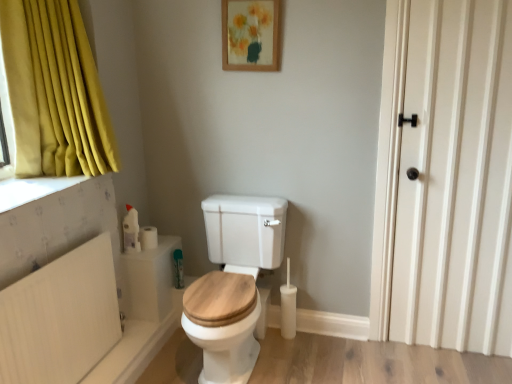
Question: In terms of width, does wooden toilet seat at center look wider or thinner when compared to white plastic radiator at lower left?

Choices:
 (A) thin
 (B) wide

Answer: (B)

Question: Is point (223, 311) positioned closer to the camera than point (92, 249)?

Choices:
 (A) closer
 (B) farther

Answer: (A)

Question: Which is nearer to the green plastic toothbrush at lower center?

Choices:
 (A) wooden toilet seat at center
 (B) wooden picture frame at upper center
 (C) white matte toilet paper at lower left, marked as the 2th toilet paper in a back-to-front arrangement
 (D) white plastic radiator at lower left
 (E) white matte toilet paper at lower left, the first toilet paper viewed from the back

Answer: (E)

Question: Which object is positioned closest to the white matte door at right?

Choices:
 (A) wooden toilet seat at center
 (B) wooden picture frame at upper center
 (C) white matte toilet paper at lower left, positioned as the first toilet paper in front-to-back order
 (D) white plastic radiator at lower left
 (E) white matte toilet paper at lower left, the first toilet paper viewed from the back

Answer: (A)